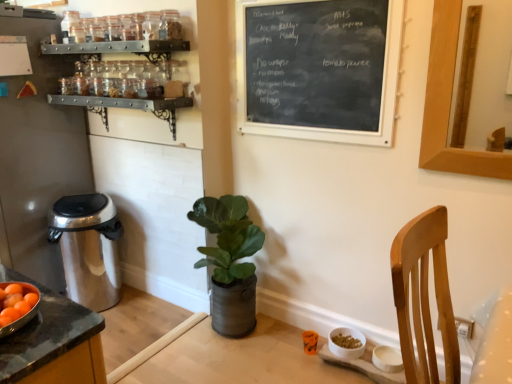
What do you see at coordinates (319, 69) in the screenshot?
I see `black chalkboard at upper center` at bounding box center [319, 69].

Where is `metallic black spice rack at upper left, arranged as the 1th shelf when ordered from the bottom`? Image resolution: width=512 pixels, height=384 pixels. metallic black spice rack at upper left, arranged as the 1th shelf when ordered from the bottom is located at coordinates (129, 71).

Describe the element at coordinates (230, 262) in the screenshot. I see `green leafy plant in metallic pot at center` at that location.

Locate an element on the screen. metallic spice rack at upper left, placed as the 2th shelf when sorted from bottom to top is located at coordinates (117, 47).

Find the location of `bulletin board that is above the brushed metal trash can at left (from a real-world perspective)`. bulletin board that is above the brushed metal trash can at left (from a real-world perspective) is located at coordinates (319, 69).

From the image's perspective, between brushed metal trash can at left and black chalkboard at upper center, who is located below?

brushed metal trash can at left.

Consider the image. Can you confirm if brushed metal trash can at left is shorter than black chalkboard at upper center?

Incorrect, the height of brushed metal trash can at left does not fall short of that of black chalkboard at upper center.

What's the angular difference between brushed metal trash can at left and black chalkboard at upper center's facing directions?

They differ by 1.54 degrees in their facing directions.

Is the position of metallic black spice rack at upper left, arranged as the second shelf when viewed from the top, less distant than that of green leafy plant in metallic pot at center?

Yes, it is.

From the image's perspective, does metallic black spice rack at upper left, arranged as the 1th shelf when ordered from the bottom, appear lower than green leafy plant in metallic pot at center?

Incorrect, from the image's perspective, metallic black spice rack at upper left, arranged as the 1th shelf when ordered from the bottom, is higher than green leafy plant in metallic pot at center.

What's the angular difference between metallic black spice rack at upper left, arranged as the second shelf when viewed from the top, and green leafy plant in metallic pot at center's facing directions?

The facing directions of metallic black spice rack at upper left, arranged as the second shelf when viewed from the top, and green leafy plant in metallic pot at center are 5.43e-05 degrees apart.

Based on the photo, is metallic black spice rack at upper left, arranged as the 1th shelf when ordered from the bottom, not inside green leafy plant in metallic pot at center?

metallic black spice rack at upper left, arranged as the 1th shelf when ordered from the bottom, is positioned outside green leafy plant in metallic pot at center.

In the scene shown: Is metallic black spice rack at upper left, arranged as the 1th shelf when ordered from the bottom, surrounded by metallic spice rack at upper left, the first shelf from the top?

No.

Is point (84, 51) closer to viewer compared to point (83, 79)?

Yes, point (84, 51) is in front of point (83, 79).

Locate an element on the screen. This screenshot has width=512, height=384. shelf in front of the metallic black spice rack at upper left, arranged as the 1th shelf when ordered from the bottom is located at coordinates (117, 47).

Is metallic black spice rack at upper left, arranged as the 1th shelf when ordered from the bottom, placed right next to brushed metal trash can at left?

No, metallic black spice rack at upper left, arranged as the 1th shelf when ordered from the bottom, is not with brushed metal trash can at left.

Is metallic black spice rack at upper left, arranged as the second shelf when viewed from the top, outside of brushed metal trash can at left?

Absolutely, metallic black spice rack at upper left, arranged as the second shelf when viewed from the top, is external to brushed metal trash can at left.

What's the angular difference between metallic black spice rack at upper left, arranged as the 1th shelf when ordered from the bottom, and brushed metal trash can at left's facing directions?

The facing directions of metallic black spice rack at upper left, arranged as the 1th shelf when ordered from the bottom, and brushed metal trash can at left are 0.000126 degrees apart.

Is metallic black spice rack at upper left, arranged as the 1th shelf when ordered from the bottom, aimed at brushed metal trash can at left?

No.

In the scene shown: From a real-world perspective, is metallic spice rack at upper left, the first shelf from the top, positioned above or below brushed metal trash can at left?

In terms of real-world spatial position, metallic spice rack at upper left, the first shelf from the top, is above brushed metal trash can at left.

Which is more distant, (50, 47) or (33, 151)?

Point (33, 151)

From the image's perspective, relative to brushed metal trash can at left, is metallic spice rack at upper left, placed as the 2th shelf when sorted from bottom to top, above or below?

From the image's perspective, metallic spice rack at upper left, placed as the 2th shelf when sorted from bottom to top, appears above brushed metal trash can at left.

Which object is positioned more to the left, metallic spice rack at upper left, the first shelf from the top, or brushed metal trash can at left?

From the viewer's perspective, brushed metal trash can at left appears more on the left side.

Where is `bulletin board above the brushed metal trash can at left (from a real-world perspective)`? bulletin board above the brushed metal trash can at left (from a real-world perspective) is located at coordinates (319, 69).

Measure the distance from black chalkboard at upper center to brushed metal trash can at left.

They are 1.49 meters apart.

Consider the image. Considering the sizes of objects black chalkboard at upper center and brushed metal trash can at left in the image provided, who is thinner, black chalkboard at upper center or brushed metal trash can at left?

Thinner between the two is black chalkboard at upper center.

Does black chalkboard at upper center come behind brushed metal trash can at left?

No, black chalkboard at upper center is closer to the viewer.

Could you measure the distance between satin silver trash can at left and metallic spice rack at upper left, the first shelf from the top?

satin silver trash can at left is 3.79 feet away from metallic spice rack at upper left, the first shelf from the top.

Is satin silver trash can at left wider or thinner than metallic spice rack at upper left, placed as the 2th shelf when sorted from bottom to top?

satin silver trash can at left is wider than metallic spice rack at upper left, placed as the 2th shelf when sorted from bottom to top.

From the image's perspective, which one is positioned higher, satin silver trash can at left or metallic spice rack at upper left, the first shelf from the top?

From the image's view, metallic spice rack at upper left, the first shelf from the top, is above.

Does point (68, 210) come closer to viewer compared to point (42, 50)?

No, it is behind (42, 50).

Find the location of a particular element. The width and height of the screenshot is (512, 384). appliance behind the black chalkboard at upper center is located at coordinates (38, 156).

Where is `shelf that is the 1st one above the green leafy plant in metallic pot at center (from a real-world perspective)`? Image resolution: width=512 pixels, height=384 pixels. shelf that is the 1st one above the green leafy plant in metallic pot at center (from a real-world perspective) is located at coordinates (129, 71).

Considering their positions, is satin silver trash can at left positioned further to metallic spice rack at upper left, the first shelf from the top, than black chalkboard at upper center?

Based on the image, satin silver trash can at left appears to be further to metallic spice rack at upper left, the first shelf from the top.

Looking at the image, which one is located further to brushed metal trash can at left, satin silver trash can at left or green leafy plant in metallic pot at center?

green leafy plant in metallic pot at center lies further to brushed metal trash can at left than the other object.

From the image, which object appears to be farther from metallic black spice rack at upper left, arranged as the 1th shelf when ordered from the bottom, green leafy plant in metallic pot at center or metallic spice rack at upper left, placed as the 2th shelf when sorted from bottom to top?

green leafy plant in metallic pot at center is further to metallic black spice rack at upper left, arranged as the 1th shelf when ordered from the bottom.

Estimate the real-world distances between objects in this image. Which object is closer to metallic spice rack at upper left, placed as the 2th shelf when sorted from bottom to top, metallic black spice rack at upper left, arranged as the second shelf when viewed from the top, or satin silver trash can at left?

metallic black spice rack at upper left, arranged as the second shelf when viewed from the top, is positioned closer to the anchor metallic spice rack at upper left, placed as the 2th shelf when sorted from bottom to top.

When comparing their distances from metallic spice rack at upper left, the first shelf from the top, does black chalkboard at upper center or metallic black spice rack at upper left, arranged as the second shelf when viewed from the top, seem further?

black chalkboard at upper center lies further to metallic spice rack at upper left, the first shelf from the top, than the other object.

From the image, which object appears to be farther from metallic spice rack at upper left, placed as the 2th shelf when sorted from bottom to top, metallic black spice rack at upper left, arranged as the 1th shelf when ordered from the bottom, or brushed metal trash can at left?

brushed metal trash can at left is further to metallic spice rack at upper left, placed as the 2th shelf when sorted from bottom to top.

From the picture: Which object lies further to the anchor point green leafy plant in metallic pot at center, satin silver trash can at left or metallic black spice rack at upper left, arranged as the second shelf when viewed from the top?

metallic black spice rack at upper left, arranged as the second shelf when viewed from the top.

Considering their positions, is green leafy plant in metallic pot at center positioned closer to satin silver trash can at left than black chalkboard at upper center?

Among the two, green leafy plant in metallic pot at center is located nearer to satin silver trash can at left.

Identify the location of appliance between metallic spice rack at upper left, the first shelf from the top, and satin silver trash can at left from top to bottom. (38, 156).

At what (x,y) coordinates should I click in order to perform the action: click on shelf between metallic spice rack at upper left, placed as the 2th shelf when sorted from bottom to top, and satin silver trash can at left from top to bottom. Please return your answer as a coordinate pair (x, y). Looking at the image, I should click on (129, 71).

The height and width of the screenshot is (384, 512). Identify the location of houseplant situated between satin silver trash can at left and black chalkboard at upper center from left to right. (230, 262).

Identify the location of trash bin/can between brushed metal trash can at left and metallic black spice rack at upper left, arranged as the 1th shelf when ordered from the bottom, in the horizontal direction. (88, 248).